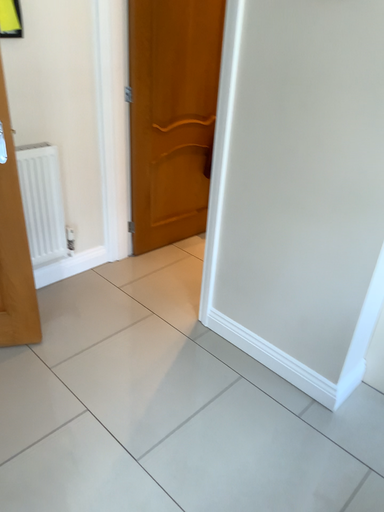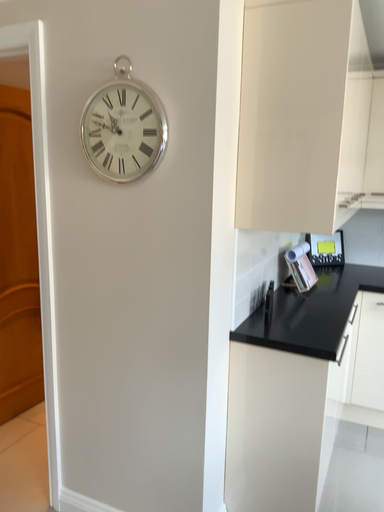
Question: How did the camera likely rotate when shooting the video?

Choices:
 (A) rotated upward
 (B) rotated downward

Answer: (A)